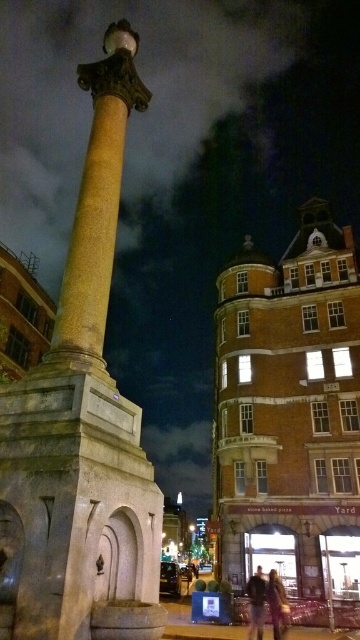
Which is behind, point (158, 596) or point (286, 611)?

The point (286, 611) is behind.

The height and width of the screenshot is (640, 360). Find the location of `marble column at center`. marble column at center is located at coordinates (82, 426).

Can you confirm if leather jacket at center is shorter than dark brown leather jacket at lower center?

No, leather jacket at center is not shorter than dark brown leather jacket at lower center.

Can you confirm if leather jacket at center is thinner than dark brown leather jacket at lower center?

Yes, leather jacket at center is thinner than dark brown leather jacket at lower center.

Locate an element on the screen. The height and width of the screenshot is (640, 360). leather jacket at center is located at coordinates (277, 605).

The height and width of the screenshot is (640, 360). I want to click on leather jacket at center, so click(277, 605).

Between marble column at center and dark brown leather jacket at lower center, which one has more height?

marble column at center is taller.

Measure the distance from marble column at center to dark brown leather jacket at lower center.

88.26 feet

What do you see at coordinates (82, 426) in the screenshot?
I see `marble column at center` at bounding box center [82, 426].

Identify the location of marble column at center. The height and width of the screenshot is (640, 360). (82, 426).